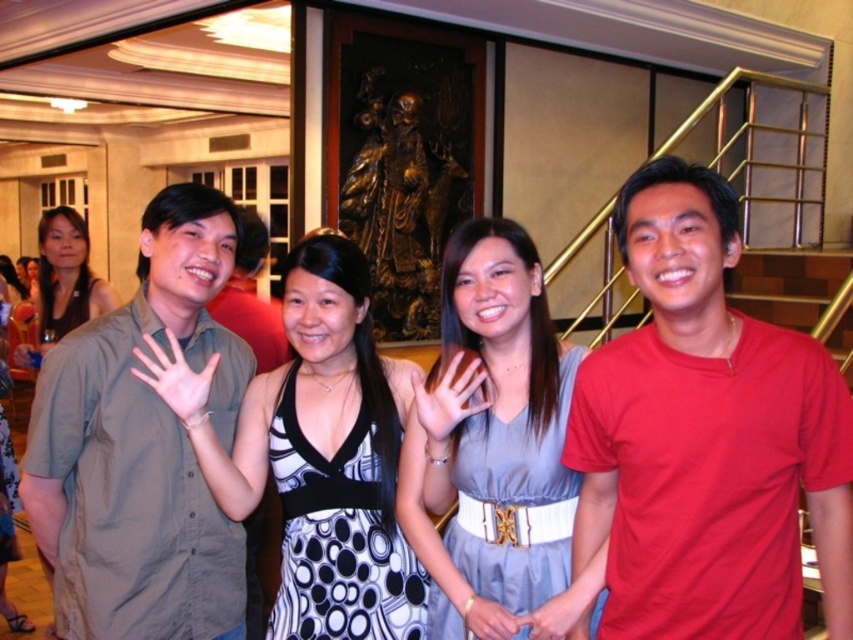
Question: Estimate the real-world distances between objects in this image. Which object is closer to the matte black dress at left?

Choices:
 (A) red cotton t-shirt at center
 (B) matte gray dress at center
 (C) matte khaki shirt at center

Answer: (C)

Question: Can you confirm if matte khaki shirt at center is wider than black dotted dress at center?

Choices:
 (A) no
 (B) yes

Answer: (A)

Question: Can you confirm if matte khaki shirt at center is positioned below black dotted dress at center?

Choices:
 (A) yes
 (B) no

Answer: (B)

Question: Which object appears farthest from the camera in this image?

Choices:
 (A) black dotted dress at center
 (B) matte gray shirt at left
 (C) red cotton t-shirt at center
 (D) matte khaki shirt at center

Answer: (B)

Question: Is matte khaki shirt at center further to camera compared to matte gray dress at center?

Choices:
 (A) no
 (B) yes

Answer: (B)

Question: Among these points, which one is nearest to the camera?

Choices:
 (A) (154, 614)
 (B) (247, 627)
 (C) (404, 582)
 (D) (48, 330)

Answer: (A)